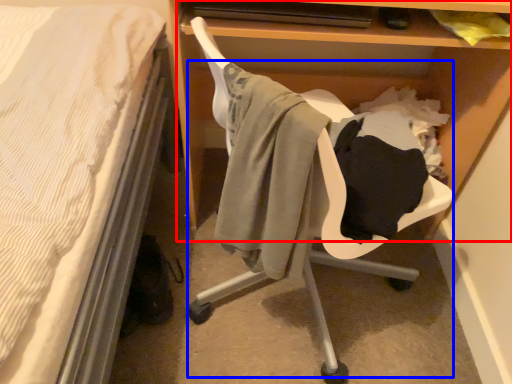
Question: Which point is closer to the camera, shelf (highlighted by a red box) or swivel chair (highlighted by a blue box)?

Choices:
 (A) shelf
 (B) swivel chair

Answer: (B)